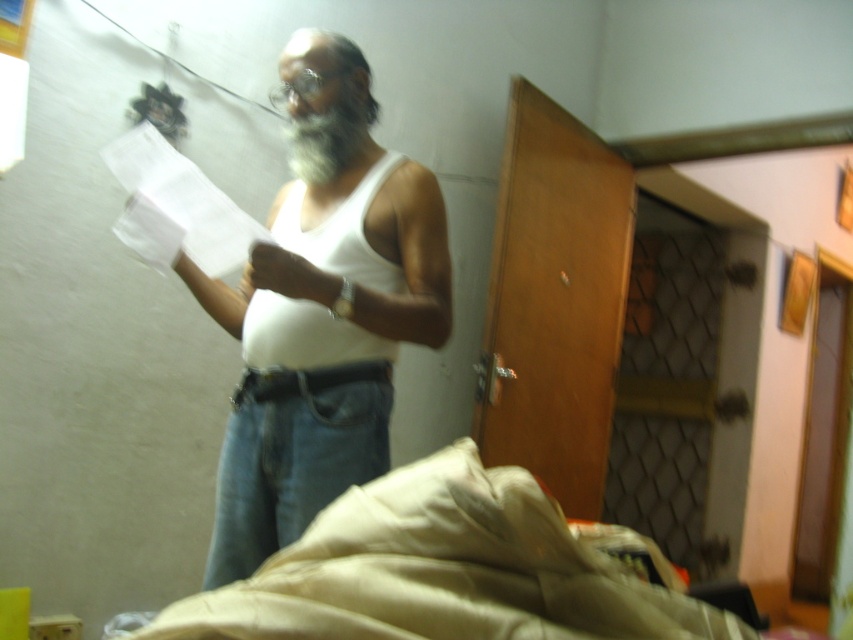
In the scene shown: You are a delivery person who needs to place a small package on the surface of the beige fabric bed at lower center or the white paper at center. Which surface can the package fit on without overlapping the edges?

The beige fabric bed at lower center is bigger than the white paper at center, so the package can fit on the beige fabric bed at lower center without overlapping the edges.

You are a delivery person trying to locate the correct room in an office building. You see two points marked on a floor plan. The first point is at coordinate point (242, 298) and the second is at point (325, 282). According to the image, which point is closer to the entrance of the room?

Point (325, 282) is closer to the entrance because point (242, 298) is behind it.